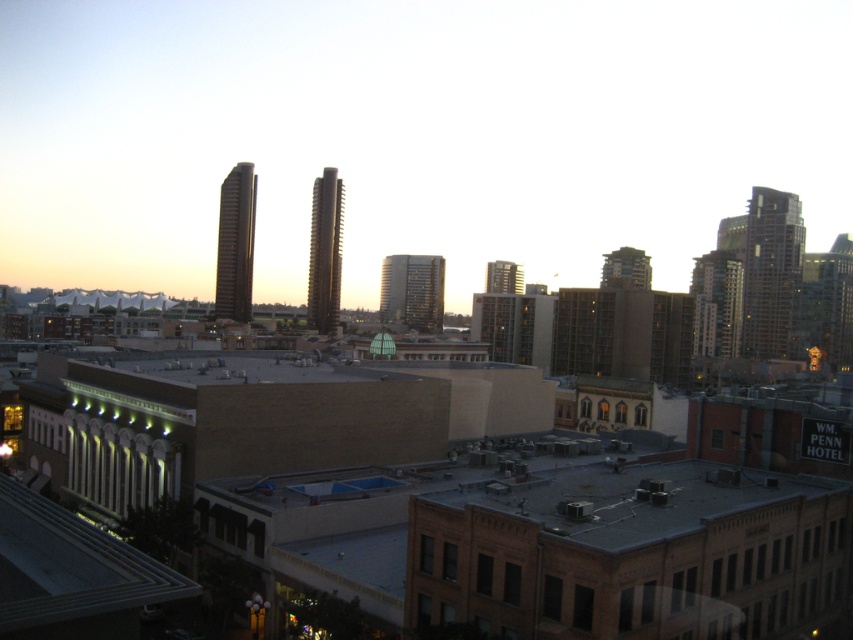
You are standing at the origin point of the city map, which is located at coordinates 0,0. You want to reach the brown brick building at center. What direction should you move in to reach it?

The brown brick building at center is located at coordinates (442, 492), so you should move northeast to reach it.

You are standing at the camera position and want to reach the point at coordinates (245, 404). If your walking speed is 1.5 meters per second, how many seconds will it take you to reach that point?

The point at coordinates (245, 404) is 72.25 meters away from the camera. At a walking speed of 1.5 meters per second, it will take 72.25 divided by 1.5, which is approximately 48.17 seconds. So, it will take about 48 seconds to reach the point.

You are an urban planner assessing the city layout. You notice the brown brick building at center and the smooth glass skyscraper at center. Which of these two buildings has a greater width in the image?

The brown brick building at center has a greater width than the smooth glass skyscraper at center according to the description.